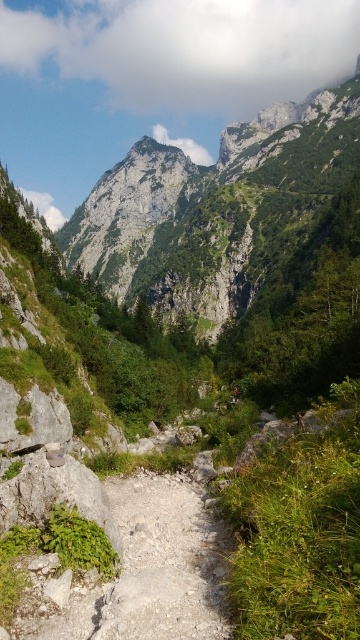
You are a hiker planning to walk along the dusty gravel path at center. You see the red fabric mountain biker at center ahead of you. Which side should you move to avoid them?

The dusty gravel path at center is to the left of the red fabric mountain biker at center, so you should move to the right side of the path to avoid them.

You are a hiker planning to take a photo of the rugged stone mountain at upper center. You are currently standing at the point marked by the coordinates point [216,209]. Is there any obstacle between you and the rugged stone mountain at upper center that might block your view?

The point [216,209] indicates the rugged stone mountain at upper center, so you are already at the location of the rugged stone mountain at upper center. Therefore, there are no obstacles between you and the mountain since you are standing on it.

You are a hiker planning to climb the rugged stone mountain at upper center. You see the dusty gravel path at center below it. Which direction should you head to reach the mountain from the path?

To reach the rugged stone mountain at upper center from the dusty gravel path at center, you should head upwards since the rugged stone mountain at upper center is located above the dusty gravel path at center.